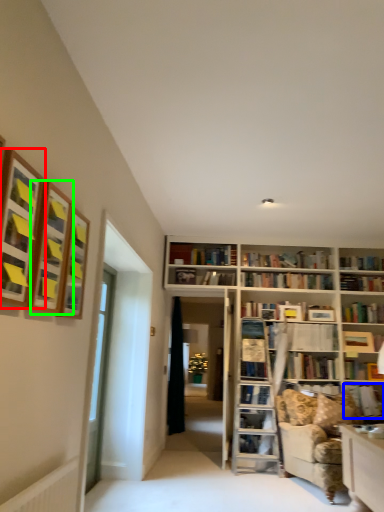
Question: Which object is positioned closest to shelf (highlighted by a red box)? Select from book (highlighted by a blue box) and shelf (highlighted by a green box).

Choices:
 (A) book
 (B) shelf

Answer: (B)